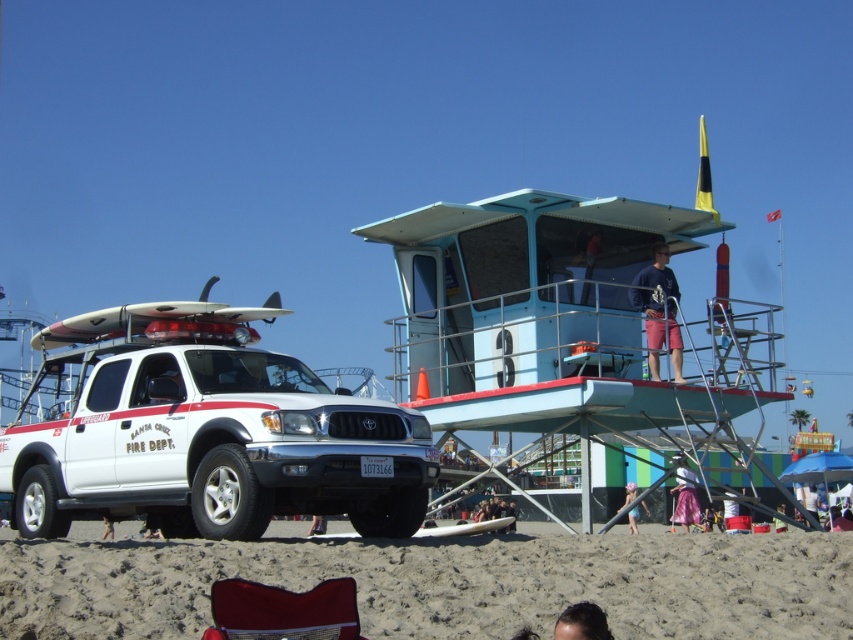
You are a beachgoer who wants to sit comfortably. You see a velvet red beach chair at lower center and a dark brown hair at lower center. Which object is wider so you can choose the best seating option?

The velvet red beach chair at lower center is wider than the dark brown hair at lower center, so it is the better seating option.

You are a visitor at the beach and want to find the pink fabric at lower right. From your current position at the brown sandy beach at lower center, in which direction should you walk to locate it?

The pink fabric at lower right is to the right of the brown sandy beach at lower center, so you should walk to the right to locate it.

You are standing at the lifeguard station in the center right of the image. If you walk straight towards the point at coordinates (444, 582), what will you encounter first?

The brown sandy beach at lower center is located at point (444, 582), so walking straight towards that point from the lifeguard station in the center right, you will first encounter the brown sandy beach at lower center.